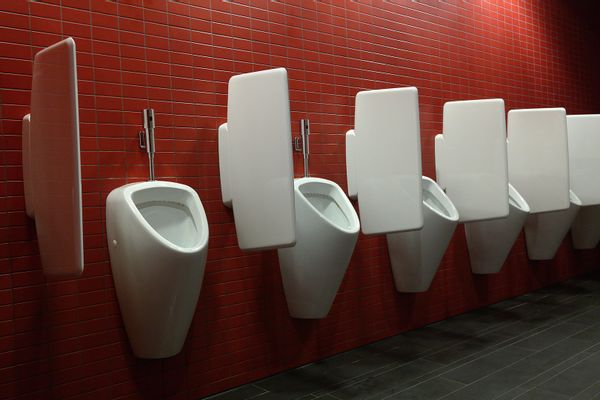
Find the location of a particular element. The height and width of the screenshot is (400, 600). urinals is located at coordinates (585, 236), (541, 239), (499, 241), (418, 248), (319, 271), (187, 296).